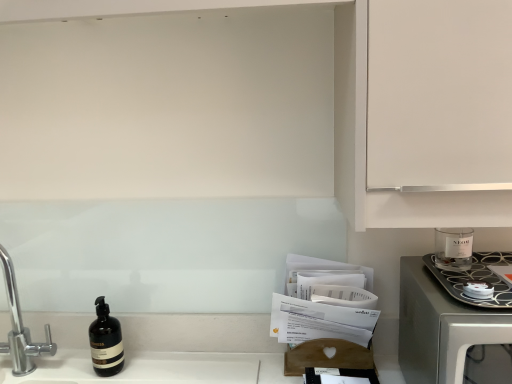
Where is `matte black bottle at lower left`? Image resolution: width=512 pixels, height=384 pixels. matte black bottle at lower left is located at coordinates (106, 341).

At what (x,y) coordinates should I click in order to perform the action: click on satin silver microwave at right. Please return your answer as a coordinate pair (x, y). The image size is (512, 384). Looking at the image, I should click on (440, 327).

The image size is (512, 384). Describe the element at coordinates (21, 328) in the screenshot. I see `chrome metallic faucet at left` at that location.

Image resolution: width=512 pixels, height=384 pixels. In order to click on clear glass candle at right in this screenshot , I will do `click(475, 279)`.

From a real-world perspective, is satin silver microwave at right positioned over clear glass candle at right based on gravity?

No, from a real-world perspective, satin silver microwave at right is not above clear glass candle at right.

Does satin silver microwave at right have a larger size compared to clear glass candle at right?

Indeed, satin silver microwave at right has a larger size compared to clear glass candle at right.

Is satin silver microwave at right positioned with its back to clear glass candle at right?

No, clear glass candle at right is not at the back of satin silver microwave at right.

Can you confirm if satin silver microwave at right is taller than clear glass candle at right?

Yes, satin silver microwave at right is taller than clear glass candle at right.

Which of these two, chrome metallic faucet at left or matte black bottle at lower left, stands taller?

With more height is chrome metallic faucet at left.

Can you tell me how much chrome metallic faucet at left and matte black bottle at lower left differ in facing direction?

2.65 degrees separate the facing orientations of chrome metallic faucet at left and matte black bottle at lower left.

Is chrome metallic faucet at left completely or partially outside of matte black bottle at lower left?

chrome metallic faucet at left lies outside matte black bottle at lower left's area.

Is chrome metallic faucet at left oriented towards matte black bottle at lower left?

No, chrome metallic faucet at left is not facing towards matte black bottle at lower left.

Which is closer, (479, 262) or (111, 318)?

The point (479, 262) is closer.

How different are the orientations of clear glass candle at right and matte black bottle at lower left in degrees?

There is a 1.47-degree angle between the facing directions of clear glass candle at right and matte black bottle at lower left.

Can matte black bottle at lower left be found inside clear glass candle at right?

No, matte black bottle at lower left is not surrounded by clear glass candle at right.

Locate an element on the screen. This screenshot has height=384, width=512. bottle on the left of the clear glass candle at right is located at coordinates (106, 341).

In terms of height, does matte black bottle at lower left look taller or shorter compared to clear glass candle at right?

matte black bottle at lower left is taller than clear glass candle at right.

Between matte black bottle at lower left and clear glass candle at right, which one appears on the right side from the viewer's perspective?

From the viewer's perspective, clear glass candle at right appears more on the right side.

Is clear glass candle at right located within matte black bottle at lower left?

No.

Are matte black bottle at lower left and clear glass candle at right far apart?

No, there isn't a large distance between matte black bottle at lower left and clear glass candle at right.

From a real-world perspective, which object rests below the other?

chrome metallic faucet at left is physically lower.

Is chrome metallic faucet at left smaller than clear glass candle at right?

No, chrome metallic faucet at left is not smaller than clear glass candle at right.

Is clear glass candle at right located within chrome metallic faucet at left?

Definitely not — clear glass candle at right is not inside chrome metallic faucet at left.

Is point (3, 259) positioned before point (459, 286)?

That is False.

Is there a large distance between clear glass candle at right and chrome metallic faucet at left?

Yes.

How different are the orientations of clear glass candle at right and chrome metallic faucet at left in degrees?

They differ by 1.18 degrees in their facing directions.

From a real-world perspective, is clear glass candle at right over chrome metallic faucet at left?

Yes, from a real-world perspective, clear glass candle at right is above chrome metallic faucet at left.

Image resolution: width=512 pixels, height=384 pixels. Identify the location of tap below the clear glass candle at right (from a real-world perspective). 21,328.

Which is more to the right, satin silver microwave at right or matte black bottle at lower left?

From the viewer's perspective, satin silver microwave at right appears more on the right side.

How different are the orientations of satin silver microwave at right and matte black bottle at lower left in degrees?

There is a 1.47-degree angle between the facing directions of satin silver microwave at right and matte black bottle at lower left.

Is point (416, 313) farther from camera compared to point (121, 335)?

No, it is in front of (121, 335).

Where is `kitchen appliance that appears above the satin silver microwave at right (from a real-world perspective)`? The width and height of the screenshot is (512, 384). kitchen appliance that appears above the satin silver microwave at right (from a real-world perspective) is located at coordinates (475, 279).

Find the location of a particular element. bottle on the right of chrome metallic faucet at left is located at coordinates (106, 341).

Consider the image. When comparing their distances from matte black bottle at lower left, does chrome metallic faucet at left or clear glass candle at right seem further?

clear glass candle at right.

Which object lies further to the anchor point matte black bottle at lower left, satin silver microwave at right or clear glass candle at right?

clear glass candle at right lies further to matte black bottle at lower left than the other object.

Looking at the image, which one is located closer to clear glass candle at right, chrome metallic faucet at left or satin silver microwave at right?

satin silver microwave at right is positioned closer to the anchor clear glass candle at right.

Considering their positions, is matte black bottle at lower left positioned further to satin silver microwave at right than clear glass candle at right?

Based on the image, matte black bottle at lower left appears to be further to satin silver microwave at right.

Which object lies nearer to the anchor point satin silver microwave at right, clear glass candle at right or matte black bottle at lower left?

clear glass candle at right is closer to satin silver microwave at right.

Which object lies further to the anchor point matte black bottle at lower left, chrome metallic faucet at left or satin silver microwave at right?

The object further to matte black bottle at lower left is satin silver microwave at right.

Estimate the real-world distances between objects in this image. Which object is closer to chrome metallic faucet at left, clear glass candle at right or matte black bottle at lower left?

matte black bottle at lower left is positioned closer to the anchor chrome metallic faucet at left.

Estimate the real-world distances between objects in this image. Which object is further from chrome metallic faucet at left, satin silver microwave at right or matte black bottle at lower left?

Among the two, satin silver microwave at right is located further to chrome metallic faucet at left.

I want to click on bottle located between chrome metallic faucet at left and clear glass candle at right in the left-right direction, so click(x=106, y=341).

What are the coordinates of `kitchen appliance between chrome metallic faucet at left and satin silver microwave at right in the horizontal direction` in the screenshot? It's located at (475, 279).

Find the location of a particular element. The image size is (512, 384). bottle between chrome metallic faucet at left and satin silver microwave at right is located at coordinates (106, 341).

At what (x,y) coordinates should I click in order to perform the action: click on kitchen appliance situated between matte black bottle at lower left and satin silver microwave at right from left to right. Please return your answer as a coordinate pair (x, y). The width and height of the screenshot is (512, 384). Looking at the image, I should click on (475, 279).